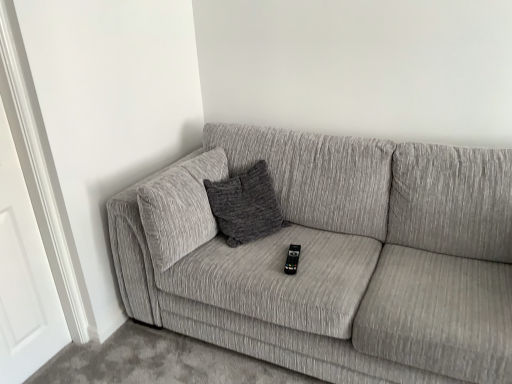
Describe the element at coordinates (24, 277) in the screenshot. I see `white wood door at left` at that location.

The width and height of the screenshot is (512, 384). I want to click on textured gray couch at center, so click(334, 258).

Which is behind, point (2, 382) or point (286, 265)?

Point (286, 265)

Consider the image. Is white wood door at left looking in the opposite direction of black plastic remote at center?

That's not correct — white wood door at left is not looking away from black plastic remote at center.

Who is bigger, white wood door at left or black plastic remote at center?

white wood door at left.

From the image's perspective, is white wood door at left located beneath black plastic remote at center?

Incorrect, from the image's perspective, white wood door at left is higher than black plastic remote at center.

Which object is positioned more to the left, white wood door at left or textured gray couch at center?

white wood door at left.

Is white wood door at left outside of textured gray couch at center?

That's correct, white wood door at left is outside of textured gray couch at center.

From a real-world perspective, is white wood door at left above or below textured gray couch at center?

white wood door at left is situated higher than textured gray couch at center in the real world.

Does white wood door at left have a smaller size compared to textured gray couch at center?

Correct, white wood door at left occupies less space than textured gray couch at center.

Between textured gray couch at center and white wood door at left, which one has larger width?

With larger width is textured gray couch at center.

Considering the points (225, 167) and (19, 295), which point is in front, point (225, 167) or point (19, 295)?

Point (19, 295)

Is textured gray couch at center inside the boundaries of white wood door at left, or outside?

textured gray couch at center exists outside the volume of white wood door at left.

Would you consider textured gray couch at center to be distant from white wood door at left?

Actually, textured gray couch at center and white wood door at left are a little close together.

Is black plastic remote at center to the right of white wood door at left from the viewer's perspective?

Yes.

From the image's perspective, is black plastic remote at center located above or below white wood door at left?

Based on their image positions, black plastic remote at center is located beneath white wood door at left.

From a real-world perspective, is black plastic remote at center positioned over white wood door at left based on gravity?

No.

Locate an element on the screen. Image resolution: width=512 pixels, height=384 pixels. door positioned vertically above the black plastic remote at center (from a real-world perspective) is located at coordinates (24, 277).

Does black plastic remote at center have a larger size compared to textured gray couch at center?

Actually, black plastic remote at center might be smaller than textured gray couch at center.

How far apart are black plastic remote at center and textured gray couch at center?

A distance of 18.24 inches exists between black plastic remote at center and textured gray couch at center.

Does black plastic remote at center lie behind textured gray couch at center?

That is True.

Which object is positioned more to the left, black plastic remote at center or textured gray couch at center?

black plastic remote at center is more to the left.

Is textured gray couch at center positioned beyond the bounds of black plastic remote at center?

Yes.

Which of these two, textured gray couch at center or black plastic remote at center, is thinner?

black plastic remote at center is thinner.

From a real-world perspective, which object stands above the other?

black plastic remote at center, from a real-world perspective.

How different are the orientations of textured gray couch at center and black plastic remote at center in degrees?

The angle between the facing direction of textured gray couch at center and the facing direction of black plastic remote at center is 13.7 degrees.

The image size is (512, 384). There is a black plastic remote at center. Identify the location of door above it (from a real-world perspective). (24, 277).

This screenshot has width=512, height=384. I want to click on door that appears on the left of textured gray couch at center, so click(24, 277).

Which object lies further to the anchor point black plastic remote at center, textured gray couch at center or white wood door at left?

white wood door at left is positioned further to the anchor black plastic remote at center.

Considering their positions, is textured gray couch at center positioned closer to white wood door at left than black plastic remote at center?

textured gray couch at center.

Considering their positions, is black plastic remote at center positioned closer to white wood door at left than textured gray couch at center?

Among the two, textured gray couch at center is located nearer to white wood door at left.

Based on their spatial positions, is white wood door at left or black plastic remote at center further from textured gray couch at center?

white wood door at left.

When comparing their distances from textured gray couch at center, does black plastic remote at center or white wood door at left seem further?

white wood door at left is further to textured gray couch at center.

From the image, which object appears to be nearer to black plastic remote at center, white wood door at left or textured gray couch at center?

textured gray couch at center is positioned closer to the anchor black plastic remote at center.

This screenshot has width=512, height=384. What are the coordinates of `remote between white wood door at left and textured gray couch at center from left to right` in the screenshot? It's located at (292, 259).